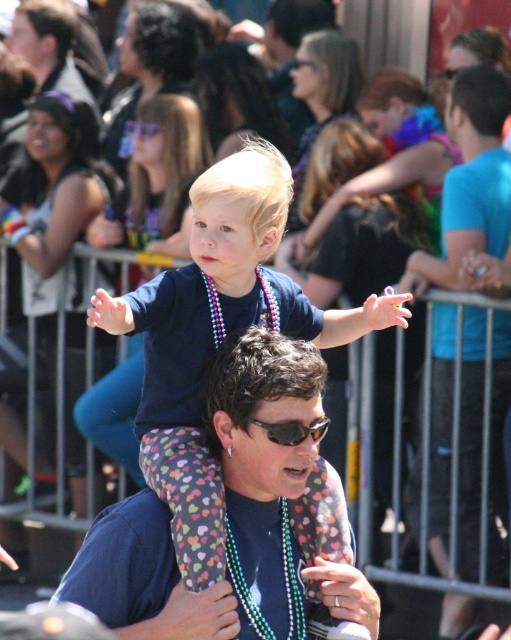
Describe the element at coordinates (218, 324) in the screenshot. The width and height of the screenshot is (511, 640). I see `dark blue shirt at center` at that location.

This screenshot has width=511, height=640. I want to click on dark blue shirt at center, so pos(218,324).

Does point (206, 464) lie in front of point (483, 243)?

Yes, point (206, 464) is closer to viewer.

Is dark blue shirt at center bigger than blue t-shirt at center?

Yes, dark blue shirt at center is bigger than blue t-shirt at center.

Where is `dark blue shirt at center`? The width and height of the screenshot is (511, 640). dark blue shirt at center is located at coordinates (218, 324).

Image resolution: width=511 pixels, height=640 pixels. What are the coordinates of `dark blue shirt at center` in the screenshot? It's located at (218, 324).

Is point (475, 364) farther from camera compared to point (299, 436)?

Yes, point (475, 364) is farther from viewer.

Does blue t-shirt at center lie in front of sunglasses at center?

No, it is behind sunglasses at center.

Is point (450, 284) closer to viewer compared to point (280, 440)?

No, it is not.

Image resolution: width=511 pixels, height=640 pixels. Find the location of `blue t-shirt at center`. blue t-shirt at center is located at coordinates (471, 182).